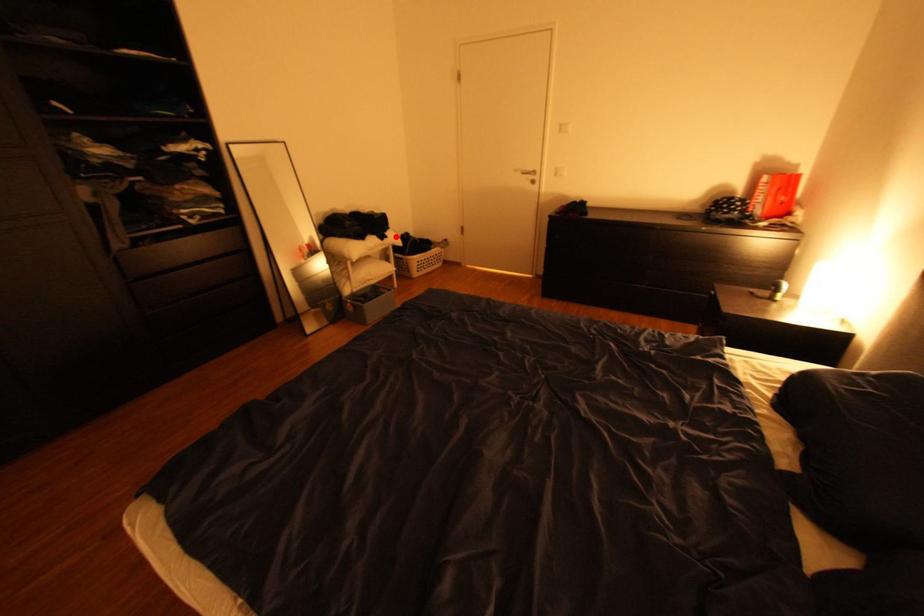
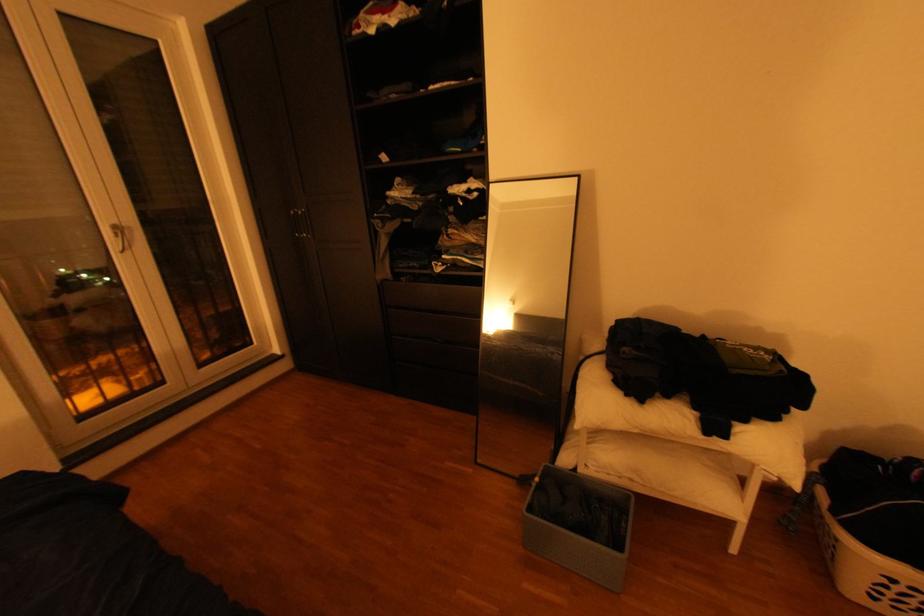
Locate, in the second image, the point that corresponds to the highlighted location in the first image.

(735, 436)